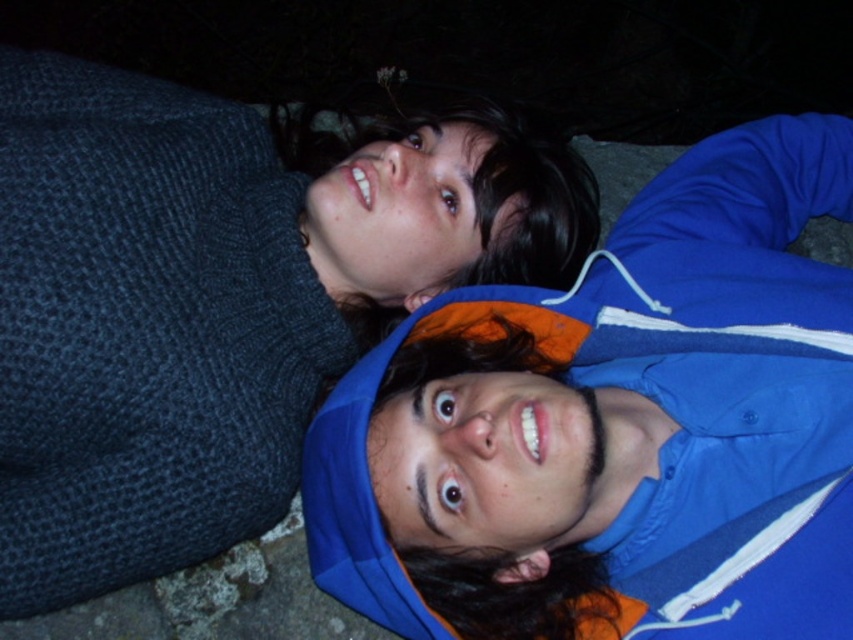
Does blue fabric jacket at upper center have a lesser width compared to knitted dark blue sweater at upper left?

Incorrect, blue fabric jacket at upper center's width is not less than knitted dark blue sweater at upper left's.

Between point (335, 500) and point (308, 413), which one is positioned behind?

The point (308, 413) is more distant.

Identify the location of blue fabric jacket at upper center. (x=616, y=417).